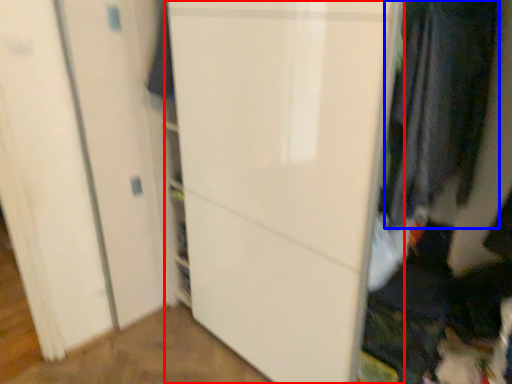
Question: Which object appears closest to the camera in this image, door (highlighted by a red box) or clothing (highlighted by a blue box)?

Choices:
 (A) door
 (B) clothing

Answer: (A)